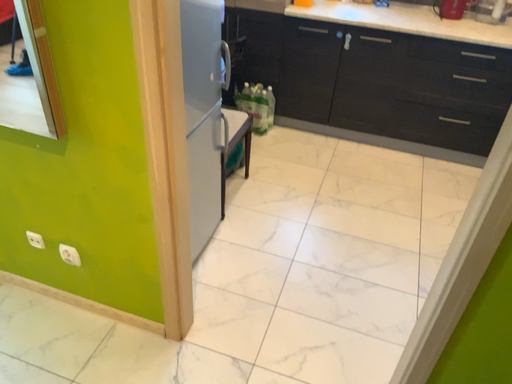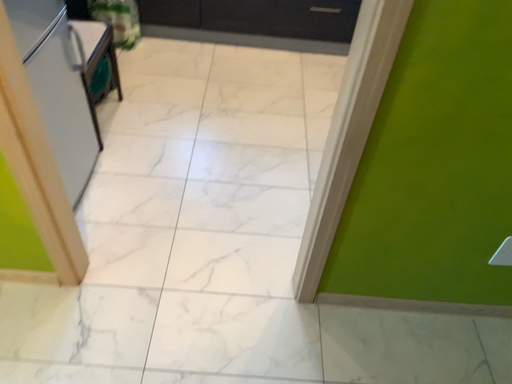
Question: Which way did the camera rotate in the video?

Choices:
 (A) rotated left
 (B) rotated right

Answer: (B)